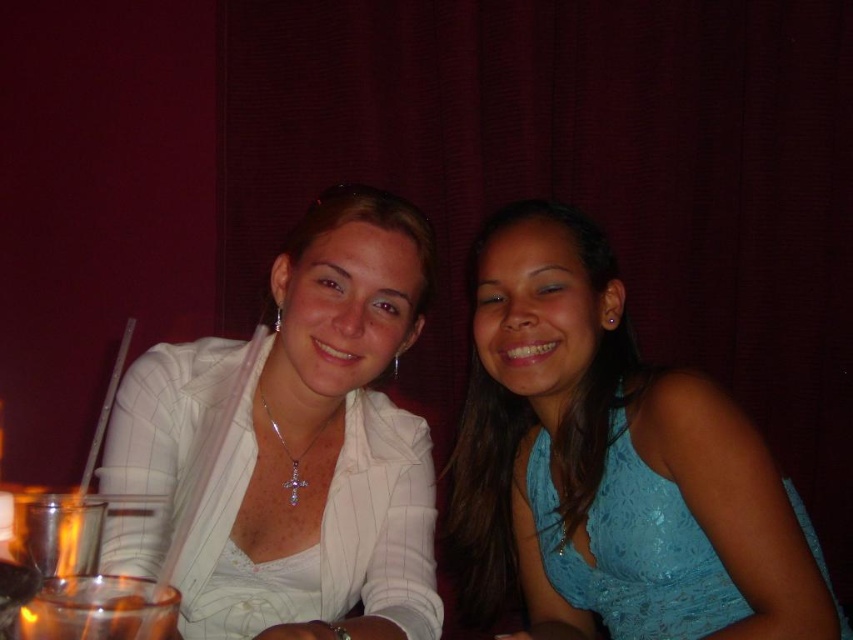
Who is positioned more to the left, blue lace dress at center or white glossy blazer at upper left?

white glossy blazer at upper left

Is point (817, 573) less distant than point (347, 429)?

Yes, it is.

Is point (612, 307) farther from camera compared to point (387, 406)?

No, it is in front of (387, 406).

In order to click on blue lace dress at center in this screenshot , I will do `click(612, 465)`.